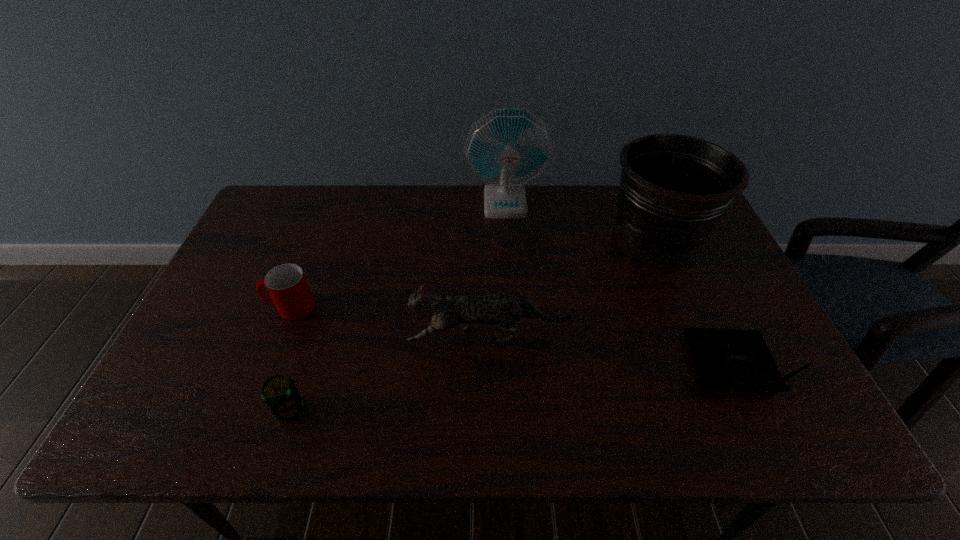
Locate an element on the screen. unoccupied position between the second tallest object and the cup is located at coordinates (473, 273).

Find the location of a particular element. The image size is (960, 540). free space between the bucket and the router is located at coordinates (692, 303).

Find the location of a particular element. The height and width of the screenshot is (540, 960). empty space between the beer can and the fan is located at coordinates (397, 306).

Locate an element on the screen. This screenshot has height=540, width=960. unoccupied position between the fourth shortest object and the router is located at coordinates (608, 353).

The image size is (960, 540). I want to click on free space between the second tallest object and the fourth nearest object, so click(x=473, y=273).

Where is `free space between the cup and the fan`? free space between the cup and the fan is located at coordinates (397, 255).

What are the coordinates of `object that stands as the fifth closest to the beer can` in the screenshot? It's located at (733, 359).

Locate an element on the screen. This screenshot has height=540, width=960. object identified as the fifth closest to the fan is located at coordinates (280, 394).

Image resolution: width=960 pixels, height=540 pixels. I want to click on vacant space that satisfies the following two spatial constraints: 1. in front of the tallest object to face the airflow; 2. on the left side of the router, so click(516, 368).

The height and width of the screenshot is (540, 960). Identify the location of vacant region that satisfies the following two spatial constraints: 1. on the face of the third tallest object; 2. on the left side of the router. click(x=489, y=368).